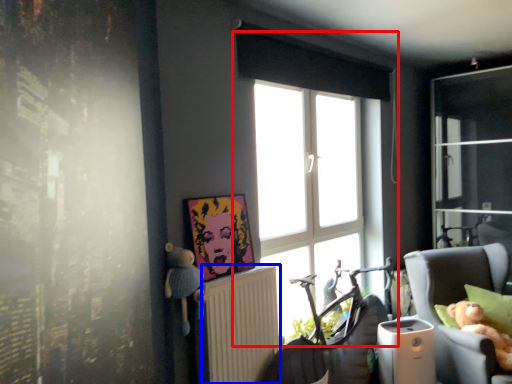
Question: Which point is closer to the camera, window (highlighted by a red box) or radiator (highlighted by a blue box)?

Choices:
 (A) window
 (B) radiator

Answer: (B)